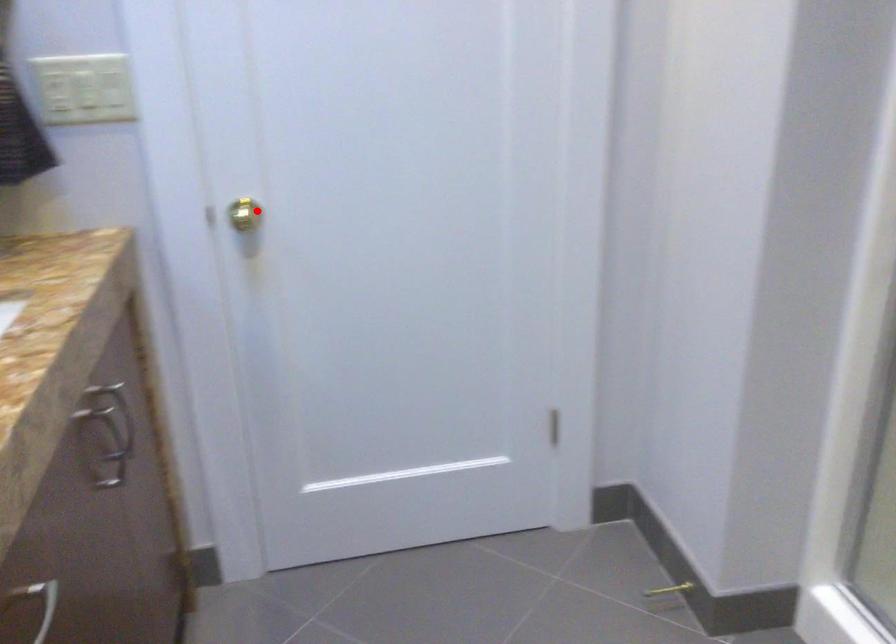
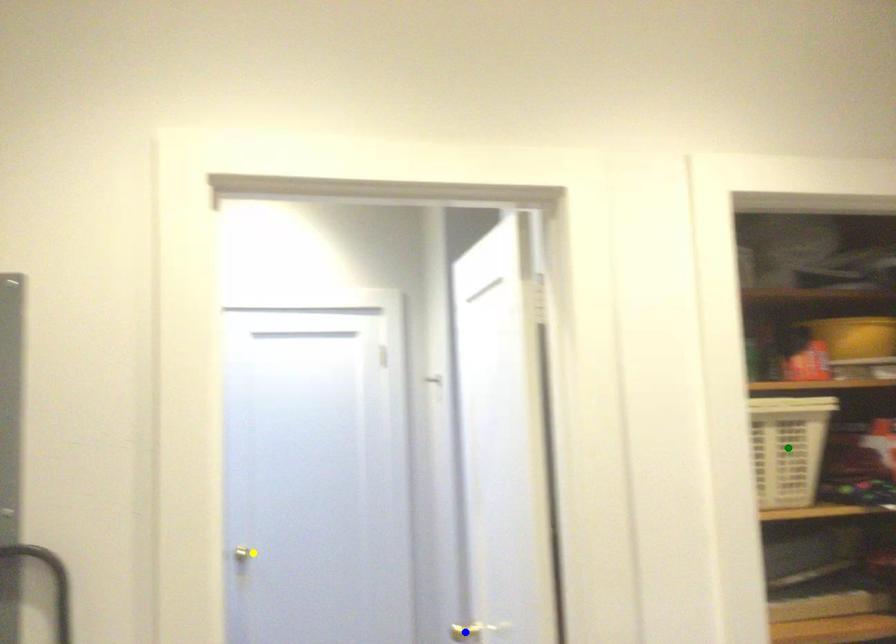
Question: I am providing you with two images of the same scene from different viewpoints. A red point is marked on the first image. You are given multiple points on the second image. Which spot in image 2 lines up with the point in image 1?

Choices:
 (A) yellow point
 (B) green point
 (C) blue point

Answer: (A)